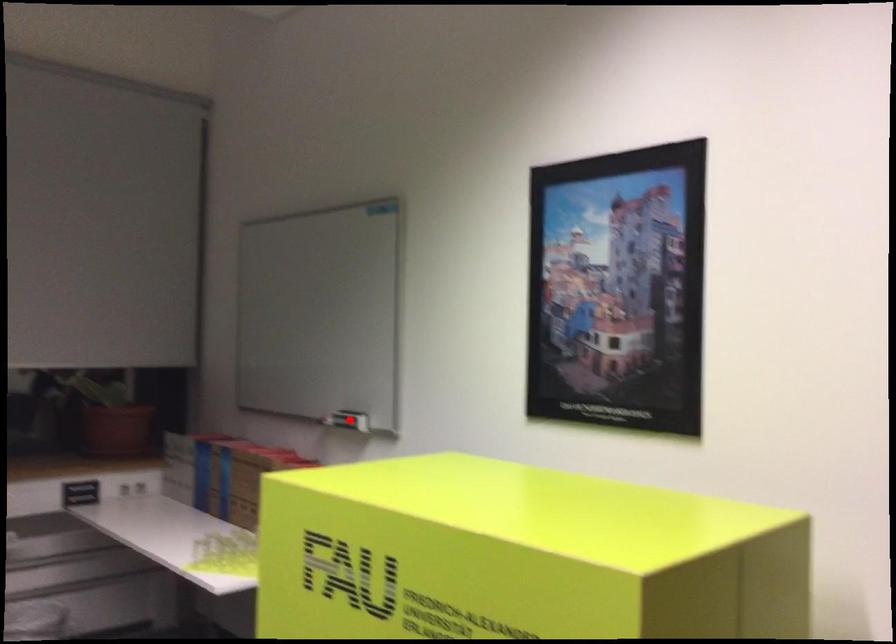
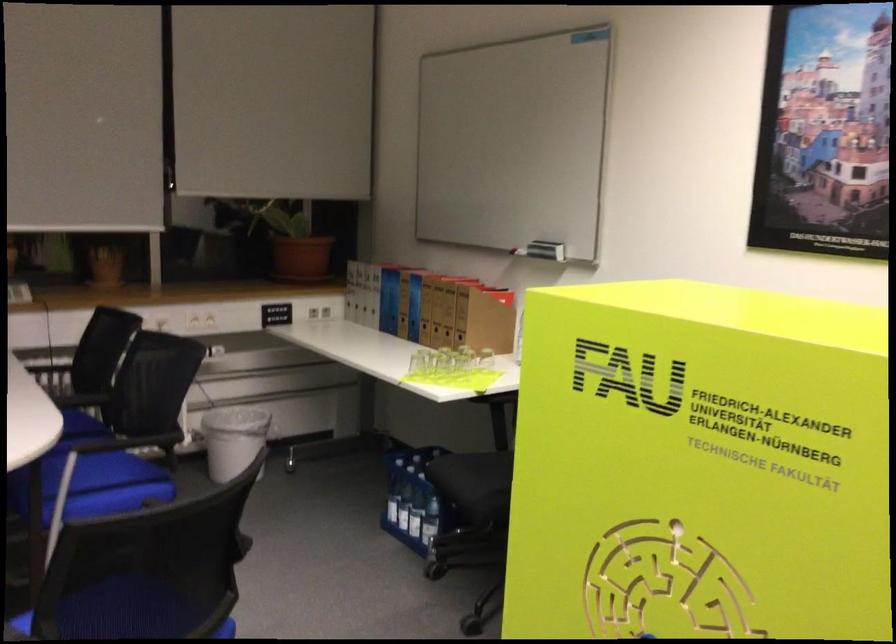
The point at the highlighted location is marked in the first image. Where is the corresponding point in the second image?

(546, 250)